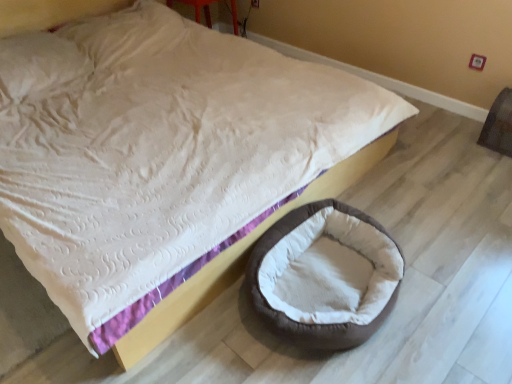
Identify the location of brown fabric bean bag at right. This screenshot has height=384, width=512. [x=499, y=125].

The image size is (512, 384). What do you see at coordinates (499, 125) in the screenshot?
I see `brown fabric bean bag at right` at bounding box center [499, 125].

You are a GUI agent. You are given a task and a screenshot of the screen. Output one action in this format:
    pyautogui.click(x=<x>, y=<y>)
    Task: Click on the brown plush dog bed at lower right
    The height and width of the screenshot is (384, 512).
    Given the screenshot: What is the action you would take?
    pyautogui.click(x=303, y=251)

The height and width of the screenshot is (384, 512). What do you see at coordinates (303, 251) in the screenshot? I see `brown plush dog bed at lower right` at bounding box center [303, 251].

What is the approximate width of brown plush dog bed at lower right?

21.66 inches.

You are a GUI agent. You are given a task and a screenshot of the screen. Output one action in this format:
    pyautogui.click(x=<x>, y=<y>)
    Task: Click on the brown fabric bean bag at right
    The image size is (512, 384).
    Given the screenshot: What is the action you would take?
    pyautogui.click(x=499, y=125)

Is brown fabric bean bag at right at the right side of brown plush dog bed at lower right?

Correct, you'll find brown fabric bean bag at right to the right of brown plush dog bed at lower right.

Is brown fabric bean bag at right further to the viewer compared to brown plush dog bed at lower right?

Yes, brown fabric bean bag at right is further from the camera.

Is point (501, 112) farther from camera compared to point (272, 252)?

Yes.

In the scene shown: From the image's perspective, is brown fabric bean bag at right located beneath brown plush dog bed at lower right?

No, from the image's perspective, brown fabric bean bag at right is not beneath brown plush dog bed at lower right.

From a real-world perspective, is brown fabric bean bag at right under brown plush dog bed at lower right?

Actually, brown fabric bean bag at right is physically above brown plush dog bed at lower right in the real world.

Does brown fabric bean bag at right have a lesser width compared to brown plush dog bed at lower right?

Yes.

Considering the relative sizes of brown fabric bean bag at right and brown plush dog bed at lower right in the image provided, is brown fabric bean bag at right taller than brown plush dog bed at lower right?

Indeed, brown fabric bean bag at right has a greater height compared to brown plush dog bed at lower right.

Who is smaller, brown fabric bean bag at right or brown plush dog bed at lower right?

Smaller between the two is brown fabric bean bag at right.

Is brown fabric bean bag at right inside or outside of brown plush dog bed at lower right?

brown fabric bean bag at right lies outside brown plush dog bed at lower right.

In the scene shown: Is brown fabric bean bag at right in contact with brown plush dog bed at lower right?

No, brown fabric bean bag at right is not next to brown plush dog bed at lower right.

Does brown fabric bean bag at right turn towards brown plush dog bed at lower right?

Yes, brown fabric bean bag at right is facing brown plush dog bed at lower right.

You are a GUI agent. You are given a task and a screenshot of the screen. Output one action in this format:
    pyautogui.click(x=<x>, y=<y>)
    Task: Click on the dog bed below the brown fabric bean bag at right (from a real-world perspective)
    This screenshot has width=512, height=384.
    Given the screenshot: What is the action you would take?
    pyautogui.click(x=303, y=251)

Can you confirm if brown plush dog bed at lower right is positioned to the right of brown fabric bean bag at right?

No.

Which is behind, brown plush dog bed at lower right or brown fabric bean bag at right?

brown fabric bean bag at right is behind.

Considering the positions of points (259, 281) and (511, 108), is point (259, 281) closer to camera compared to point (511, 108)?

Yes.

From the image's perspective, which is above, brown plush dog bed at lower right or brown fabric bean bag at right?

brown fabric bean bag at right appears higher in the image.

From a real-world perspective, between brown plush dog bed at lower right and brown fabric bean bag at right, who is vertically lower?

brown plush dog bed at lower right, from a real-world perspective.

Looking at their sizes, would you say brown plush dog bed at lower right is wider or thinner than brown fabric bean bag at right?

In the image, brown plush dog bed at lower right appears to be wider than brown fabric bean bag at right.

Considering the sizes of brown plush dog bed at lower right and brown fabric bean bag at right in the image, is brown plush dog bed at lower right taller or shorter than brown fabric bean bag at right?

In the image, brown plush dog bed at lower right appears to be shorter than brown fabric bean bag at right.

Who is smaller, brown plush dog bed at lower right or brown fabric bean bag at right?

brown fabric bean bag at right is smaller.

Which is correct: brown plush dog bed at lower right is inside brown fabric bean bag at right, or outside of it?

brown plush dog bed at lower right lies outside brown fabric bean bag at right.

Based on the photo, would you say brown plush dog bed at lower right is a long distance from brown fabric bean bag at right?

Yes, brown plush dog bed at lower right and brown fabric bean bag at right are quite far apart.

Is brown fabric bean bag at right at the back of brown plush dog bed at lower right?

No, brown fabric bean bag at right is not at the back of brown plush dog bed at lower right.

How much distance is there between brown plush dog bed at lower right and brown fabric bean bag at right?

brown plush dog bed at lower right is 1.34 meters from brown fabric bean bag at right.

Identify the location of dog bed below the brown fabric bean bag at right (from the image's perspective). (303, 251).

Find the location of `dog bed on the left of the brown fabric bean bag at right`. dog bed on the left of the brown fabric bean bag at right is located at coordinates (303, 251).

Identify the location of dog bed beneath the brown fabric bean bag at right (from a real-world perspective). The height and width of the screenshot is (384, 512). (303, 251).